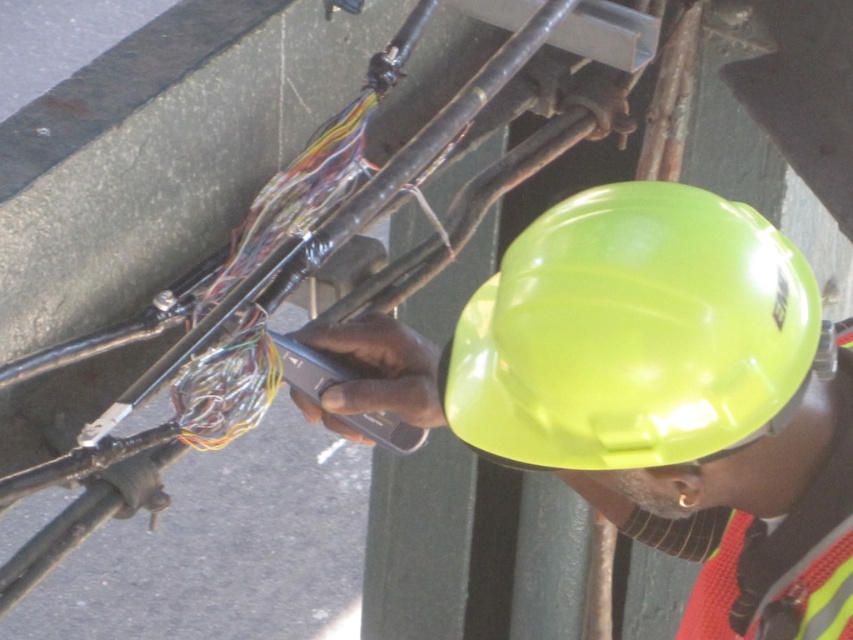
Is neon yellow hard hat at center closer to the viewer compared to glossy hard hat at center?

That is False.

Is point (740, 330) closer to camera compared to point (769, 244)?

Yes, point (740, 330) is in front of point (769, 244).

At what (x,y) coordinates should I click in order to perform the action: click on neon yellow hard hat at center. Please return your answer as a coordinate pair (x, y). The width and height of the screenshot is (853, 640). Looking at the image, I should click on coord(642,380).